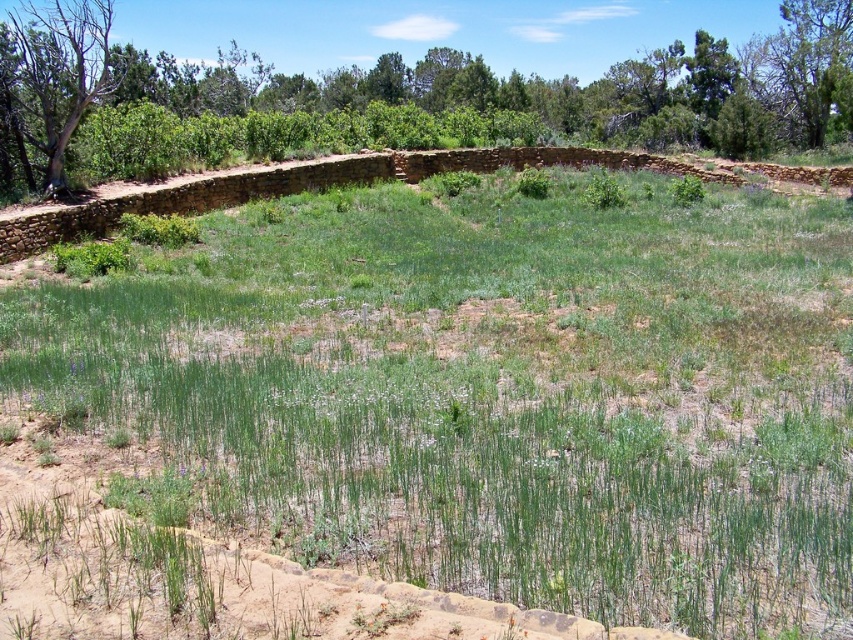
Find the location of a particular element. This screenshot has height=640, width=853. green leafy tree at upper left is located at coordinates (393, 99).

Between point (242, 90) and point (791, 48), which one is positioned in front?

Point (791, 48) is more forward.

Where is `green leafy tree at upper left`? green leafy tree at upper left is located at coordinates (393, 99).

This screenshot has height=640, width=853. What do you see at coordinates (59, 72) in the screenshot?
I see `brown bark tree at upper left` at bounding box center [59, 72].

Does brown bark tree at upper left appear on the right side of green leafy tree at upper right?

Incorrect, brown bark tree at upper left is not on the right side of green leafy tree at upper right.

Which is behind, point (51, 74) or point (764, 99)?

Positioned behind is point (764, 99).

What are the coordinates of `brown bark tree at upper left` in the screenshot? It's located at (59, 72).

What do you see at coordinates (489, 392) in the screenshot?
I see `green grassy at center` at bounding box center [489, 392].

Between point (97, 433) and point (784, 42), which one is positioned behind?

The point (784, 42) is behind.

Is point (113, 435) farther from viewer compared to point (786, 17)?

No.

You are a GUI agent. You are given a task and a screenshot of the screen. Output one action in this format:
    pyautogui.click(x=<x>, y=<y>)
    Task: Click on the green grassy at center
    
    Given the screenshot: What is the action you would take?
    pyautogui.click(x=489, y=392)